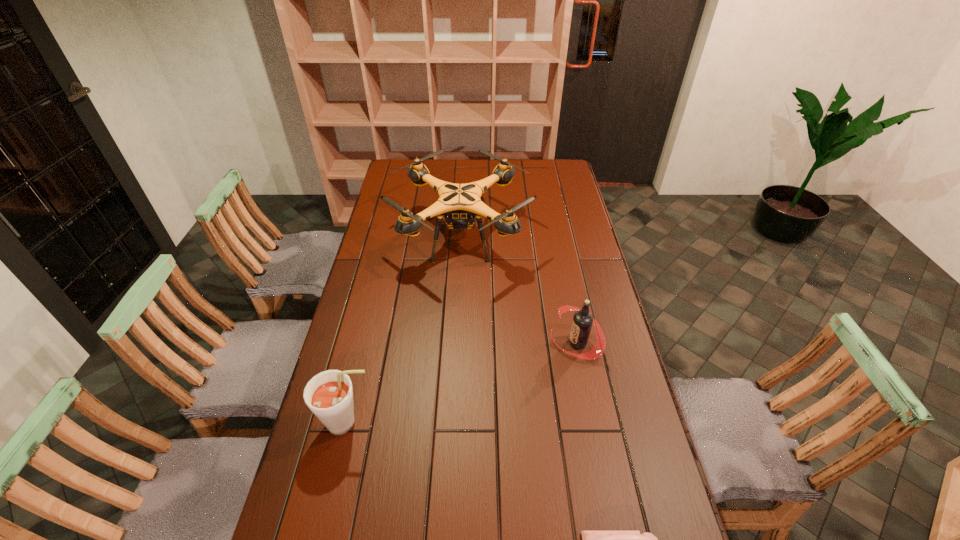
Select which object appears as the closest to the drone. Please provide its 2D coordinates. Your answer should be formatted as a tuple, i.e. [(x, y)], where the tuple contains the x and y coordinates of a point satisfying the conditions above.

[(582, 322)]

Locate an element on the screen. This screenshot has height=540, width=960. the third closest object to the farthest object is located at coordinates (591, 539).